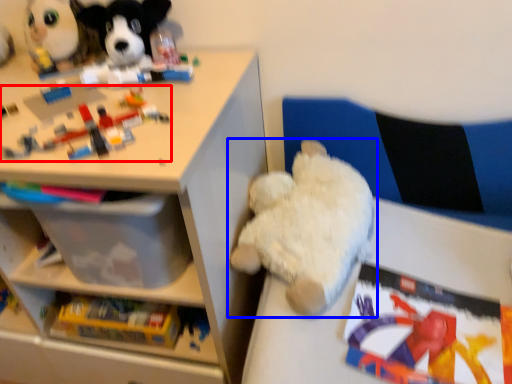
Question: Which point is further to the camera, toy (highlighted by a red box) or toy (highlighted by a blue box)?

Choices:
 (A) toy
 (B) toy

Answer: (B)